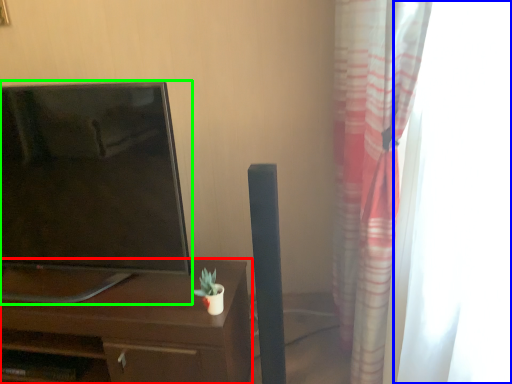
Question: Considering the real-world distances, which object is farthest from desk (highlighted by a red box)? glass door (highlighted by a blue box) or television (highlighted by a green box)?

Choices:
 (A) glass door
 (B) television

Answer: (A)